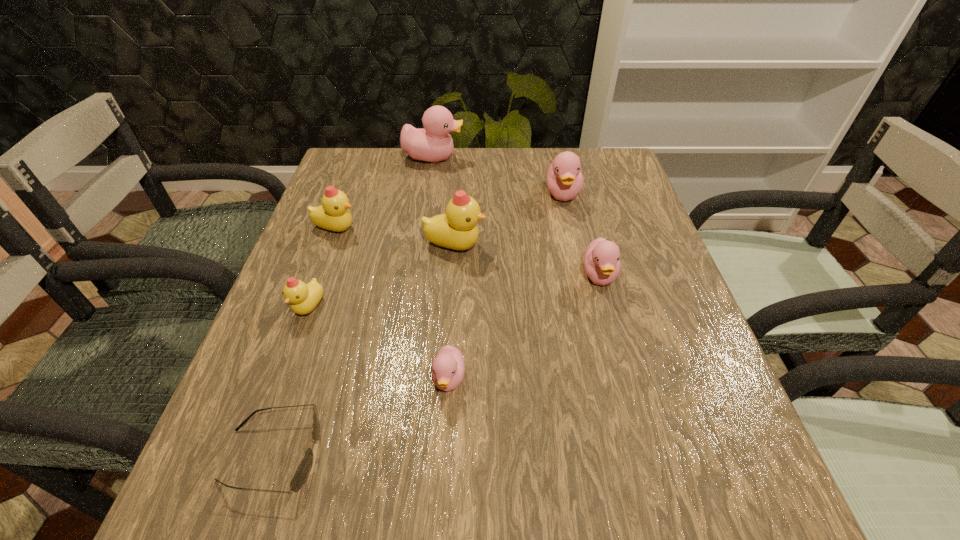
Where is `the farthest object`? This screenshot has height=540, width=960. the farthest object is located at coordinates (434, 144).

This screenshot has height=540, width=960. I want to click on the farthest duckling, so (434, 144).

I want to click on the rightmost yellow duckling, so click(x=457, y=229).

Locate an element on the screen. The image size is (960, 540). the second farthest duckling is located at coordinates (564, 178).

Locate an element on the screen. This screenshot has height=540, width=960. the second farthest pink duckling is located at coordinates (564, 178).

Where is `the second biggest yellow duckling`? The image size is (960, 540). the second biggest yellow duckling is located at coordinates (334, 215).

Identify the location of the second smallest pink duckling. This screenshot has height=540, width=960. (602, 263).

This screenshot has width=960, height=540. Identify the location of the smallest yellow duckling. (303, 298).

Where is `the nearest duckling`? This screenshot has height=540, width=960. the nearest duckling is located at coordinates [448, 367].

This screenshot has height=540, width=960. In order to click on the smallest pink duckling in this screenshot , I will do `click(448, 367)`.